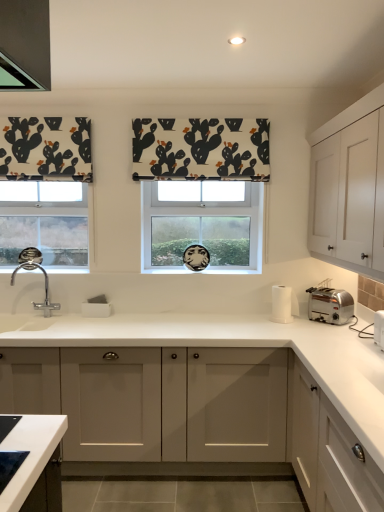
Question: Does white paper towel holder at right, positioned as the 1th appliance in back-to-front order, contain white fabric with cactus print at center?

Choices:
 (A) no
 (B) yes

Answer: (A)

Question: From the image's perspective, is white paper towel holder at right, the 2th appliance from the right, below white fabric with cactus print at center?

Choices:
 (A) yes
 (B) no

Answer: (A)

Question: Is white paper towel holder at right, positioned as the 1th appliance in back-to-front order, further to camera compared to white fabric with cactus print at center?

Choices:
 (A) yes
 (B) no

Answer: (B)

Question: Could you tell me if white paper towel holder at right, positioned as the 1th appliance in back-to-front order, is facing white fabric with cactus print at center?

Choices:
 (A) yes
 (B) no

Answer: (B)

Question: From a real-world perspective, is white paper towel holder at right, arranged as the first appliance when viewed from the left, physically below white fabric with cactus print at center?

Choices:
 (A) no
 (B) yes

Answer: (B)

Question: From the image's perspective, is white matte cabinet at center, which is counted as the second cabinetry, starting from the top, positioned above or below white fabric with cactus print at center?

Choices:
 (A) below
 (B) above

Answer: (A)

Question: From a real-world perspective, is white matte cabinet at center, placed as the second cabinetry when sorted from bottom to top, physically located above or below white fabric with cactus print at center?

Choices:
 (A) above
 (B) below

Answer: (B)

Question: Considering the relative positions of white matte cabinet at center, which is counted as the second cabinetry, starting from the top, and white fabric with cactus print at center in the image provided, is white matte cabinet at center, which is counted as the second cabinetry, starting from the top, to the left or to the right of white fabric with cactus print at center?

Choices:
 (A) right
 (B) left

Answer: (B)

Question: Is white matte cabinet at center, placed as the second cabinetry when sorted from bottom to top, in front of or behind white fabric with cactus print at center in the image?

Choices:
 (A) behind
 (B) front

Answer: (B)

Question: Is point (372, 168) closer or farther from the camera than point (309, 459)?

Choices:
 (A) farther
 (B) closer

Answer: (B)

Question: Relative to white matte cabinet at lower right, arranged as the 3th cabinetry when viewed from the top, is white matte cabinet at upper right, acting as the third cabinetry starting from the bottom, in front or behind?

Choices:
 (A) front
 (B) behind

Answer: (B)

Question: Choose the correct answer: Is white matte cabinet at upper right, marked as the 1th cabinetry in a top-to-bottom arrangement, inside white matte cabinet at lower right, arranged as the 3th cabinetry when viewed from the top, or outside it?

Choices:
 (A) outside
 (B) inside

Answer: (A)

Question: From the image's perspective, is white matte cabinet at upper right, acting as the third cabinetry starting from the bottom, located above or below white matte cabinet at lower right, acting as the 1th cabinetry starting from the bottom?

Choices:
 (A) above
 (B) below

Answer: (A)

Question: Considering their positions, is satin silver toaster at right located in front of or behind white fabric with cactus print at center?

Choices:
 (A) behind
 (B) front

Answer: (B)

Question: From the image's perspective, is satin silver toaster at right located above or below white fabric with cactus print at center?

Choices:
 (A) above
 (B) below

Answer: (B)